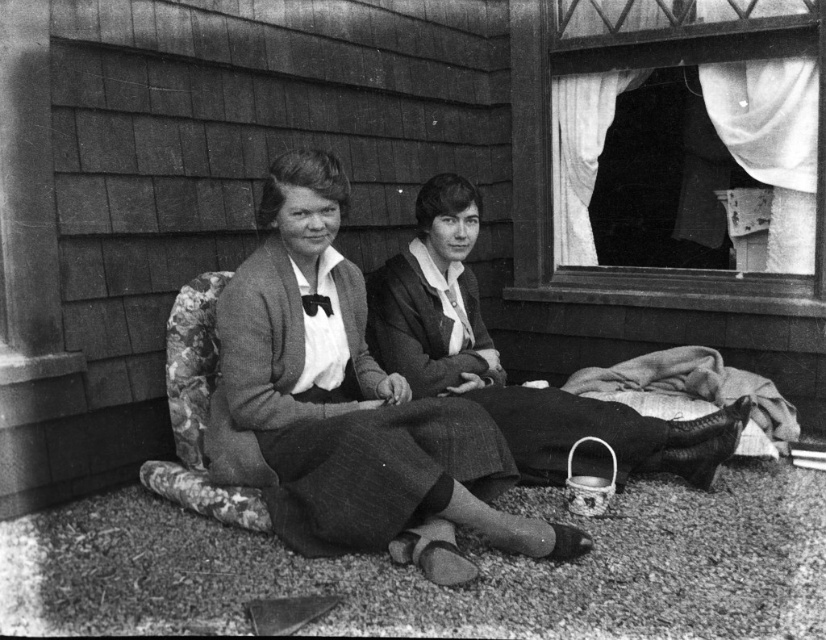
Who is higher up, matte black dress at center or smooth fabric dress at center?

smooth fabric dress at center

Does matte black dress at center have a larger size compared to smooth fabric dress at center?

Yes.

Does point (421, 472) come behind point (472, 289)?

No.

Identify the location of matte black dress at center. This screenshot has height=640, width=826. (350, 404).